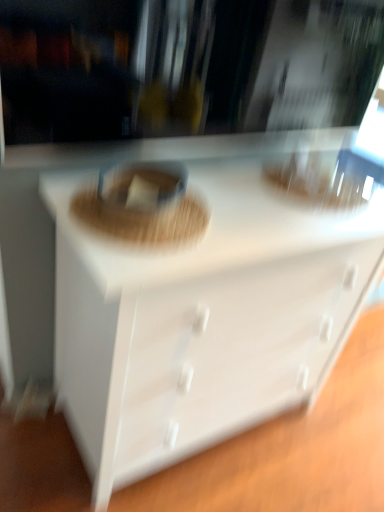
This screenshot has height=512, width=384. I want to click on unoccupied area in front of brown woven basket at center, so click(x=114, y=246).